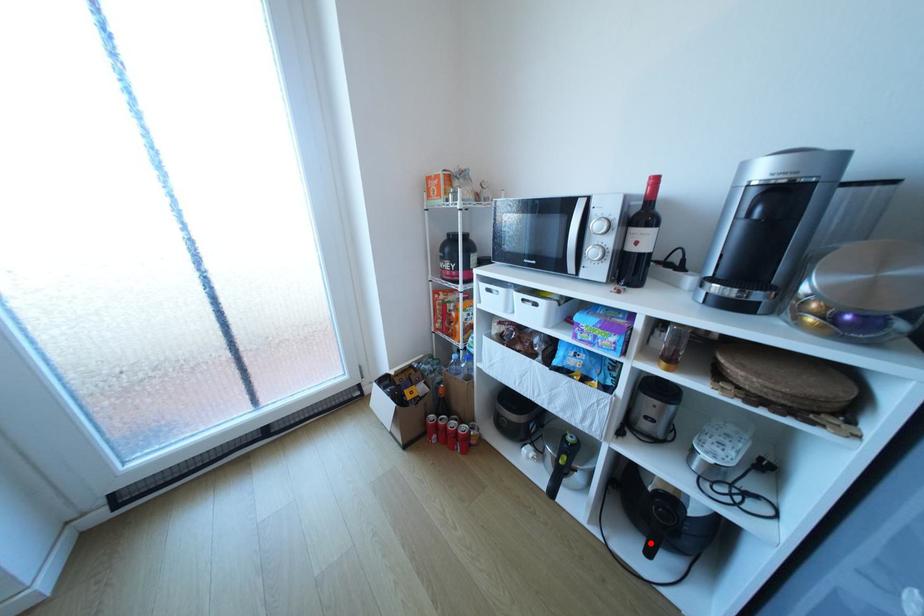
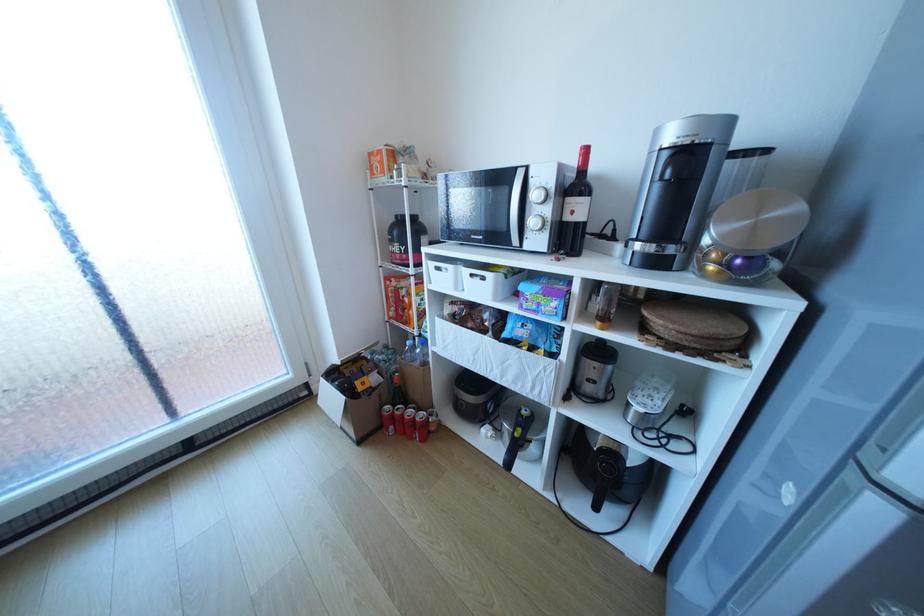
Question: I am providing you with two images of the same scene from different viewpoints. Given a red point in image1, look at the same physical point in image2. Is it:

Choices:
 (A) Closer to the viewpoint
 (B) Farther from the viewpoint

Answer: (A)